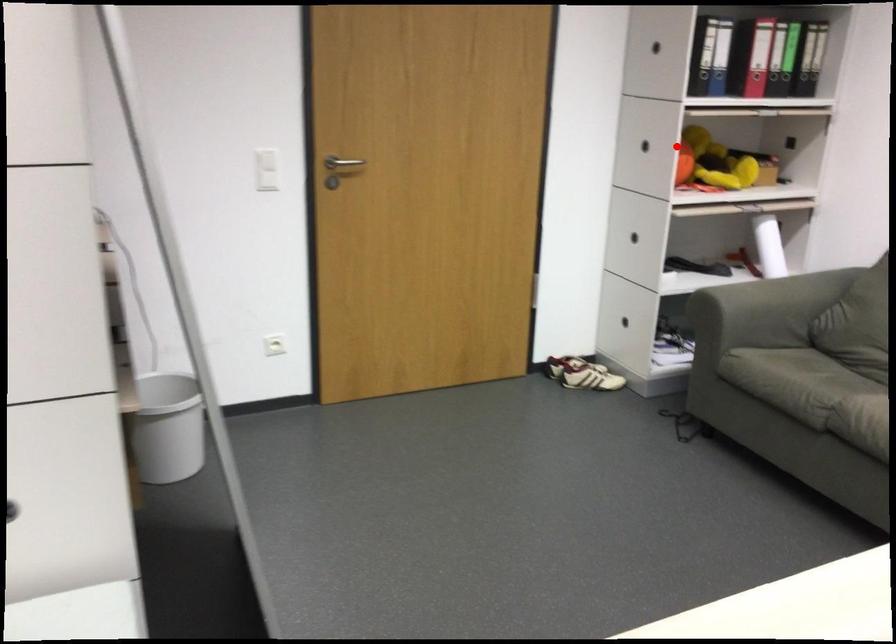
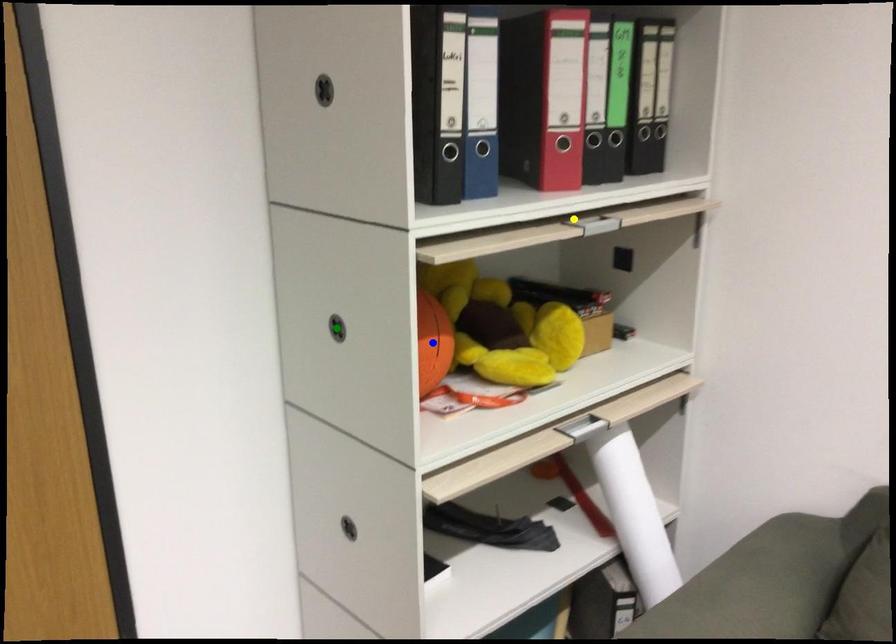
Question: I am providing you with two images of the same scene from different viewpoints. A red point is marked on the first image. You are given multiple points on the second image. Can you choose the point in image 2 that corresponds to the point in image 1?

Choices:
 (A) blue point
 (B) yellow point
 (C) green point

Answer: (A)